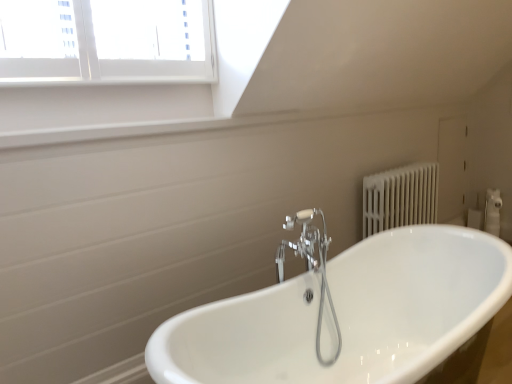
Question: Should I look upward or downward to see chrome metallic faucet at center?

Choices:
 (A) up
 (B) down

Answer: (B)

Question: Is chrome metallic faucet at center not near white glossy bathtub at center?

Choices:
 (A) no
 (B) yes

Answer: (A)

Question: Is chrome metallic faucet at center taller than white glossy bathtub at center?

Choices:
 (A) yes
 (B) no

Answer: (A)

Question: Considering the relative sizes of chrome metallic faucet at center and white glossy bathtub at center in the image provided, is chrome metallic faucet at center wider than white glossy bathtub at center?

Choices:
 (A) yes
 (B) no

Answer: (B)

Question: From a real-world perspective, is chrome metallic faucet at center positioned over white glossy bathtub at center based on gravity?

Choices:
 (A) no
 (B) yes

Answer: (B)

Question: Does chrome metallic faucet at center appear on the right side of white glossy bathtub at center?

Choices:
 (A) no
 (B) yes

Answer: (A)

Question: Is chrome metallic faucet at center directly adjacent to white glossy bathtub at center?

Choices:
 (A) yes
 (B) no

Answer: (B)

Question: From a real-world perspective, is white glossy bathtub at center under chrome metallic faucet at center?

Choices:
 (A) yes
 (B) no

Answer: (A)

Question: Does white glossy bathtub at center have a lesser height compared to chrome metallic faucet at center?

Choices:
 (A) no
 (B) yes

Answer: (B)

Question: Is white glossy bathtub at center far from chrome metallic faucet at center?

Choices:
 (A) yes
 (B) no

Answer: (B)

Question: Can you confirm if white glossy bathtub at center is thinner than chrome metallic faucet at center?

Choices:
 (A) no
 (B) yes

Answer: (A)

Question: From a real-world perspective, is white glossy bathtub at center on top of chrome metallic faucet at center?

Choices:
 (A) yes
 (B) no

Answer: (B)

Question: Is white glossy bathtub at center beside chrome metallic faucet at center?

Choices:
 (A) yes
 (B) no

Answer: (B)

Question: Looking at their shapes, would you say chrome metallic faucet at center is wider or thinner than white glossy bathtub at center?

Choices:
 (A) wide
 (B) thin

Answer: (B)